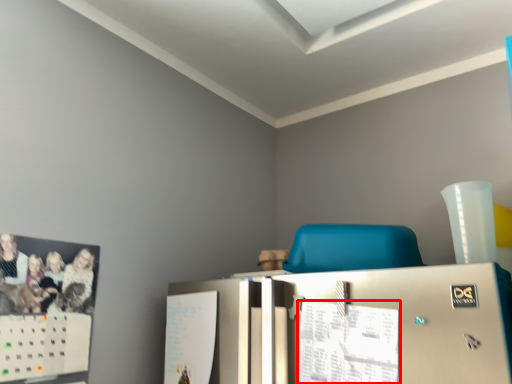
Question: From the image's perspective, where is paper (annotated by the red box) located relative to furniture?

Choices:
 (A) below
 (B) above

Answer: (A)